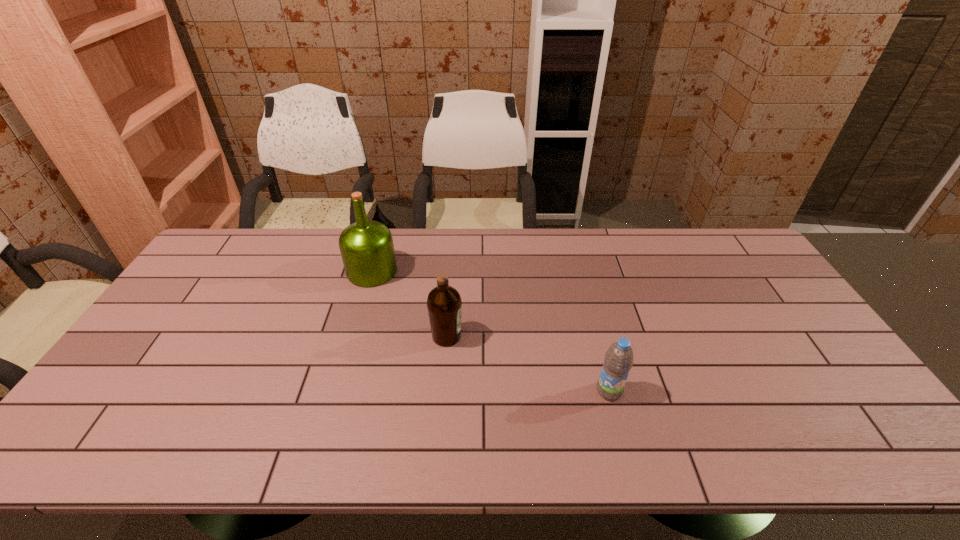
You are a GUI agent. You are given a task and a screenshot of the screen. Output one action in this format:
    pyautogui.click(x=<x>, y=<y>)
    Task: Click on the free spot that satisfies the following two spatial constraints: 1. on the label of the water bottle; 2. on the right side of the second object from left to right
    
    Given the screenshot: What is the action you would take?
    pyautogui.click(x=443, y=391)

The image size is (960, 540). I want to click on vacant region that satisfies the following two spatial constraints: 1. on the label of the nearer olive oil; 2. on the back side of the water bottle, so click(x=443, y=391).

I want to click on vacant area that satisfies the following two spatial constraints: 1. on the front side of the water bottle; 2. on the left side of the leftmost object, so click(338, 391).